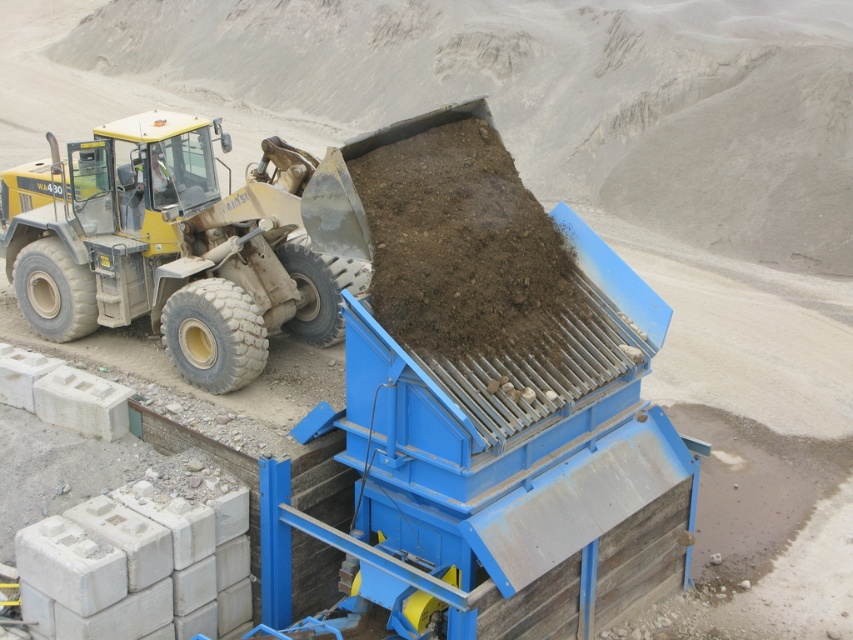
The image size is (853, 640). Describe the element at coordinates (173, 246) in the screenshot. I see `yellow rubber tractor at left` at that location.

Based on the photo, who is more forward, [38,264] or [409,342]?

Point [409,342] is in front.

Identify the location of yellow rubber tractor at left. (173, 246).

What are the coordinates of `yellow rubber tractor at left` in the screenshot? It's located at (173, 246).